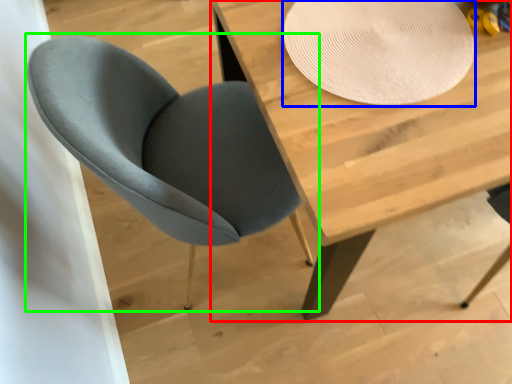
Question: Based on their relative distances, which object is nearer to table (highlighted by a red box)? Choose from paper plate (highlighted by a blue box) and chair (highlighted by a green box).

Choices:
 (A) paper plate
 (B) chair

Answer: (A)